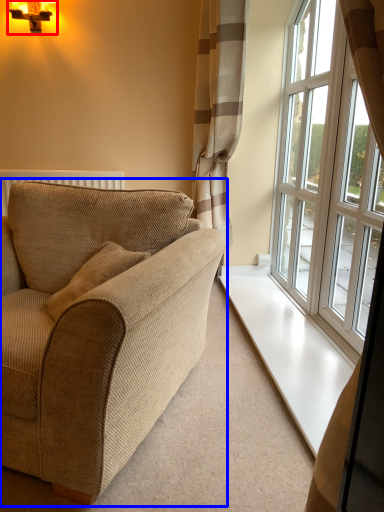
Question: Which of the following is the farthest to the observer, light fixture (highlighted by a red box) or studio couch (highlighted by a blue box)?

Choices:
 (A) light fixture
 (B) studio couch

Answer: (A)